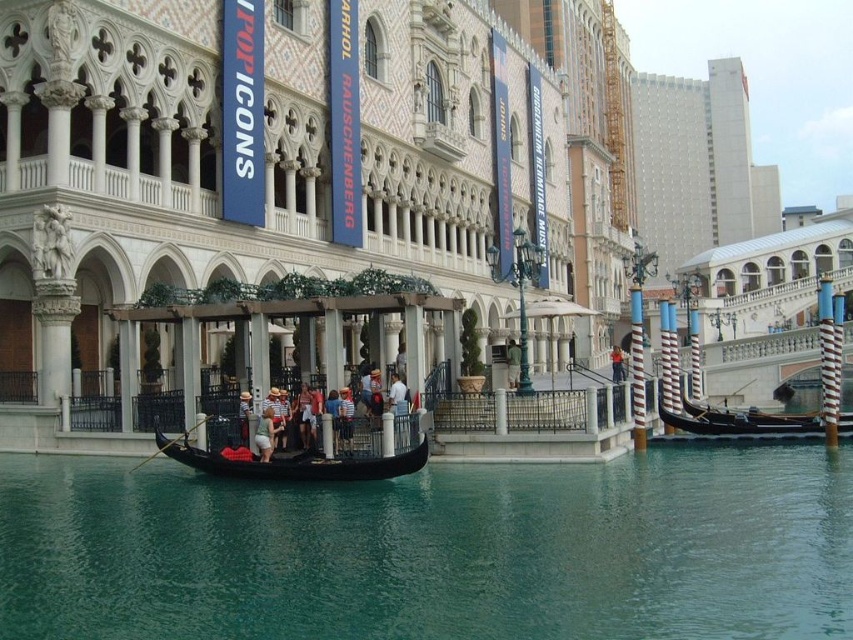
Is point (801, 428) in front of point (612, 364)?

Yes, point (801, 428) is in front of point (612, 364).

Between black polished wood gondola at right and light blue denim jeans at center, which one is positioned higher?

light blue denim jeans at center is higher up.

I want to click on black polished wood gondola at right, so click(x=738, y=420).

At what (x,y) coordinates should I click in order to perform the action: click on black polished wood gondola at right. Please return your answer as a coordinate pair (x, y). The image size is (853, 640). Looking at the image, I should click on (738, 420).

Between point (267, 435) and point (618, 352), which one is positioned behind?

Positioned behind is point (618, 352).

Image resolution: width=853 pixels, height=640 pixels. What do you see at coordinates (265, 433) in the screenshot?
I see `light green fabric shirt at center` at bounding box center [265, 433].

Where is `light green fabric shirt at center`? light green fabric shirt at center is located at coordinates (265, 433).

The image size is (853, 640). Identify the location of matte black gondola at lower center. (334, 161).

Which is above, matte black gondola at lower center or black polished wood gondola at right?

matte black gondola at lower center is above.

Is point (32, 300) positioned behind point (746, 410)?

No.

Image resolution: width=853 pixels, height=640 pixels. Find the location of `matte black gondola at lower center`. matte black gondola at lower center is located at coordinates (334, 161).